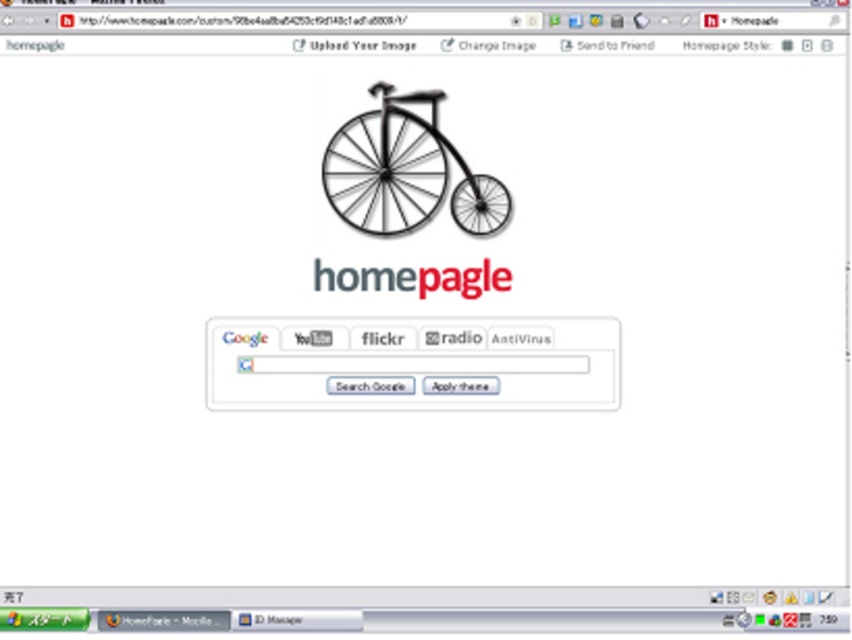
Does red matte homepage at center appear on the left side of black matte wheel at center?

Correct, you'll find red matte homepage at center to the left of black matte wheel at center.

Looking at this image, who is more distant from viewer, [471,282] or [475,232]?

Point [475,232]

Locate an element on the screen. This screenshot has width=852, height=640. red matte homepage at center is located at coordinates (413, 278).

At what (x,y) coordinates should I click in order to perform the action: click on red matte homepage at center. Please return your answer as a coordinate pair (x, y). This screenshot has width=852, height=640. Looking at the image, I should click on (413, 278).

Consider the image. Between black matte bicycle at center and red matte homepage at center, which one has more height?

With more height is black matte bicycle at center.

From the picture: Between black matte bicycle at center and red matte homepage at center, which one is positioned lower?

red matte homepage at center is lower down.

The width and height of the screenshot is (852, 640). I want to click on black matte bicycle at center, so click(x=404, y=172).

Does black matte bicycle at center appear on the right side of black matte wheel at center?

In fact, black matte bicycle at center is to the left of black matte wheel at center.

Is black matte bicycle at center closer to camera compared to black matte wheel at center?

Yes.

What do you see at coordinates (404, 172) in the screenshot?
I see `black matte bicycle at center` at bounding box center [404, 172].

At what (x,y) coordinates should I click in order to perform the action: click on black matte bicycle at center. Please return your answer as a coordinate pair (x, y). Image resolution: width=852 pixels, height=640 pixels. Looking at the image, I should click on (404, 172).